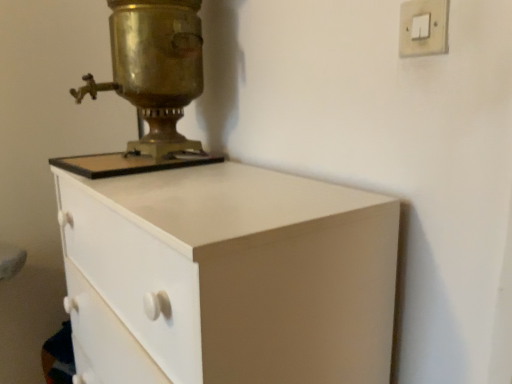
This screenshot has height=384, width=512. Describe the element at coordinates (423, 27) in the screenshot. I see `gold metallic light switch at upper right` at that location.

The width and height of the screenshot is (512, 384). Describe the element at coordinates (227, 277) in the screenshot. I see `white matte chest of drawers at center` at that location.

Locate an element on the screen. gold metallic light switch at upper right is located at coordinates pos(423,27).

From the picture: From a real-world perspective, who is located higher, white matte chest of drawers at center or brass/bronze metallic samovar at upper left?

From a 3D spatial view, brass/bronze metallic samovar at upper left is above.

Considering the relative sizes of white matte chest of drawers at center and brass/bronze metallic samovar at upper left in the image provided, is white matte chest of drawers at center wider than brass/bronze metallic samovar at upper left?

Indeed, white matte chest of drawers at center has a greater width compared to brass/bronze metallic samovar at upper left.

Is white matte chest of drawers at center far away from brass/bronze metallic samovar at upper left?

white matte chest of drawers at center is actually quite close to brass/bronze metallic samovar at upper left.

In terms of height, does white matte chest of drawers at center look taller or shorter compared to brass/bronze metallic samovar at upper left?

Clearly, white matte chest of drawers at center is taller compared to brass/bronze metallic samovar at upper left.

Are brass/bronze metallic samovar at upper left and white matte chest of drawers at center far apart?

No.

Which object is positioned more to the right, brass/bronze metallic samovar at upper left or white matte chest of drawers at center?

white matte chest of drawers at center.

From the image's perspective, which is above, brass/bronze metallic samovar at upper left or white matte chest of drawers at center?

brass/bronze metallic samovar at upper left, from the image's perspective.

Is white matte chest of drawers at center closer to the viewer compared to gold metallic light switch at upper right?

Yes.

Based on the photo, could gold metallic light switch at upper right be considered to be inside white matte chest of drawers at center?

No, gold metallic light switch at upper right is not surrounded by white matte chest of drawers at center.

Is point (141, 274) positioned after point (417, 7)?

Yes, point (141, 274) is farther from viewer.

Between white matte chest of drawers at center and gold metallic light switch at upper right, which one appears on the right side from the viewer's perspective?

gold metallic light switch at upper right is more to the right.

Between gold metallic light switch at upper right and brass/bronze metallic samovar at upper left, which one has more height?

With more height is brass/bronze metallic samovar at upper left.

Does gold metallic light switch at upper right lie in front of brass/bronze metallic samovar at upper left?

That is True.

Is gold metallic light switch at upper right smaller than brass/bronze metallic samovar at upper left?

Correct, gold metallic light switch at upper right occupies less space than brass/bronze metallic samovar at upper left.

How much distance is there between gold metallic light switch at upper right and white matte chest of drawers at center?

A distance of 17.67 inches exists between gold metallic light switch at upper right and white matte chest of drawers at center.

Which is behind, point (441, 52) or point (376, 376)?

The point (376, 376) is behind.

Does gold metallic light switch at upper right contain white matte chest of drawers at center?

No, white matte chest of drawers at center is not inside gold metallic light switch at upper right.

Who is more distant, gold metallic light switch at upper right or white matte chest of drawers at center?

Positioned behind is gold metallic light switch at upper right.

In the scene shown: Looking at the image, does brass/bronze metallic samovar at upper left seem bigger or smaller compared to gold metallic light switch at upper right?

In the image, brass/bronze metallic samovar at upper left appears to be larger than gold metallic light switch at upper right.

From the picture: From a real-world perspective, is brass/bronze metallic samovar at upper left positioned under gold metallic light switch at upper right based on gravity?

Yes.

Would you say brass/bronze metallic samovar at upper left is outside gold metallic light switch at upper right?

Yes.

Which object is further away from the camera taking this photo, brass/bronze metallic samovar at upper left or gold metallic light switch at upper right?

brass/bronze metallic samovar at upper left.

Find the location of a particular element. the chest of drawers that appears in front of the brass/bronze metallic samovar at upper left is located at coordinates (227, 277).

Find the location of a particular element. sewing machine on the left of the white matte chest of drawers at center is located at coordinates (150, 86).

When comparing their distances from white matte chest of drawers at center, does gold metallic light switch at upper right or brass/bronze metallic samovar at upper left seem further?

The object further to white matte chest of drawers at center is gold metallic light switch at upper right.

Looking at the image, which one is located closer to brass/bronze metallic samovar at upper left, gold metallic light switch at upper right or white matte chest of drawers at center?

white matte chest of drawers at center is positioned closer to the anchor brass/bronze metallic samovar at upper left.

From the image, which object appears to be farther from gold metallic light switch at upper right, white matte chest of drawers at center or brass/bronze metallic samovar at upper left?

brass/bronze metallic samovar at upper left.

Looking at this image, when comparing their distances from gold metallic light switch at upper right, does brass/bronze metallic samovar at upper left or white matte chest of drawers at center seem closer?

Among the two, white matte chest of drawers at center is located nearer to gold metallic light switch at upper right.

From the image, which object appears to be farther from white matte chest of drawers at center, brass/bronze metallic samovar at upper left or gold metallic light switch at upper right?

gold metallic light switch at upper right.

Considering their positions, is white matte chest of drawers at center positioned closer to brass/bronze metallic samovar at upper left than gold metallic light switch at upper right?

white matte chest of drawers at center is closer to brass/bronze metallic samovar at upper left.

At what (x,y) coordinates should I click in order to perform the action: click on light switch between brass/bronze metallic samovar at upper left and white matte chest of drawers at center in the vertical direction. Please return your answer as a coordinate pair (x, y). This screenshot has height=384, width=512. Looking at the image, I should click on [423, 27].